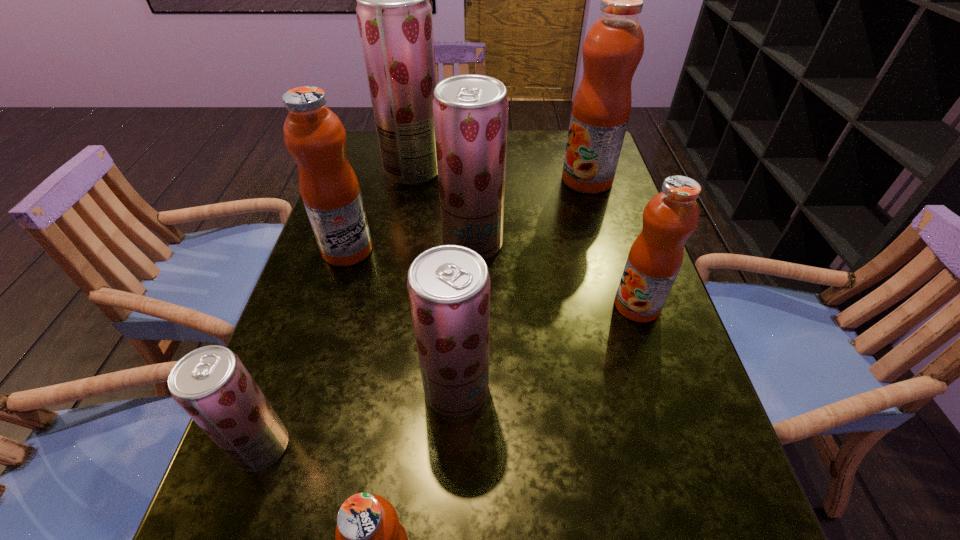
The height and width of the screenshot is (540, 960). What are the coordinates of `free space located 0.340m on the front label of the second nearest orange fruit juice` in the screenshot? It's located at (452, 306).

Where is `free space located 0.090m on the front label of the second nearest orange fruit juice`? free space located 0.090m on the front label of the second nearest orange fruit juice is located at coordinates (571, 306).

Identify the location of vacant space situated on the back of the second nearest object. (317, 290).

Locate an element on the screen. object that is at the far left corner is located at coordinates (394, 15).

You are a GUI agent. You are given a task and a screenshot of the screen. Output one action in this format:
    pyautogui.click(x=<x>, y=<y>)
    Task: Click on the object present at the far right corner
    
    Given the screenshot: What is the action you would take?
    pyautogui.click(x=614, y=45)

At what (x,y) coordinates should I click in order to perform the action: click on free space at the far edge of the desktop. Please return your answer as a coordinate pair (x, y). Looking at the image, I should click on (511, 137).

Locate an element on the screen. The height and width of the screenshot is (540, 960). free space at the near edge is located at coordinates (442, 539).

The image size is (960, 540). In the image, there is a desktop. Find the location of `vacant area at the left edge`. vacant area at the left edge is located at coordinates (275, 390).

At what (x,y) coordinates should I click in order to perform the action: click on free space at the right edge of the desktop. Please return your answer as a coordinate pair (x, y). This screenshot has width=960, height=540. Looking at the image, I should click on (682, 428).

Where is `free space that is in between the second farthest strawberry fruit juice and the fourth nearest fruit juice`? free space that is in between the second farthest strawberry fruit juice and the fourth nearest fruit juice is located at coordinates (555, 275).